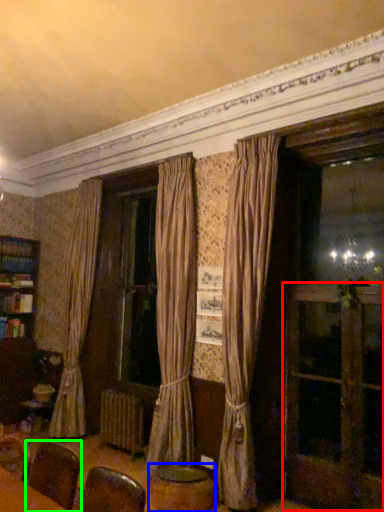
Question: Which is farther away from screen door (highlighted by a red box)? round table (highlighted by a blue box) or armchair (highlighted by a green box)?

Choices:
 (A) round table
 (B) armchair

Answer: (B)